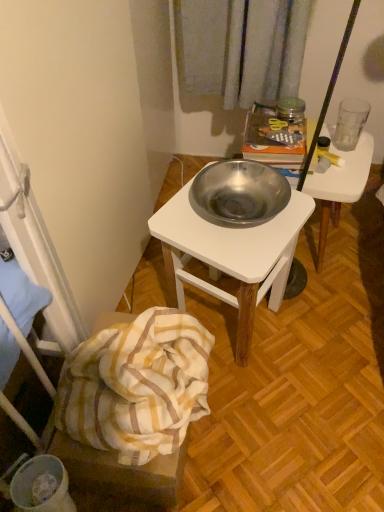
You are a GUI agent. You are given a task and a screenshot of the screen. Output one action in this format:
    pyautogui.click(x=<x>, y=<y>)
    Task: Click on the vacant space in front of metallic white desk at center, which is the 2th desk from left to right
    This screenshot has width=384, height=512.
    Given the screenshot: What is the action you would take?
    pyautogui.click(x=335, y=309)